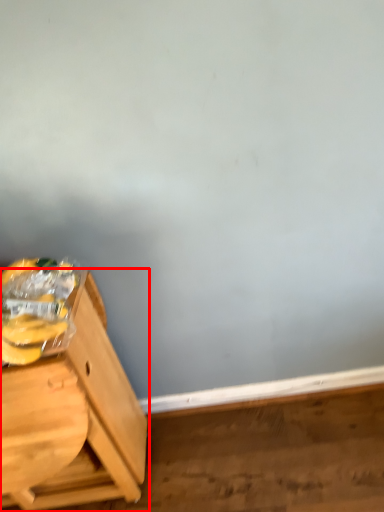
Question: From the image, what is the correct spatial relationship of furniture (annotated by the red box) in relation to banana?

Choices:
 (A) right
 (B) left

Answer: (B)